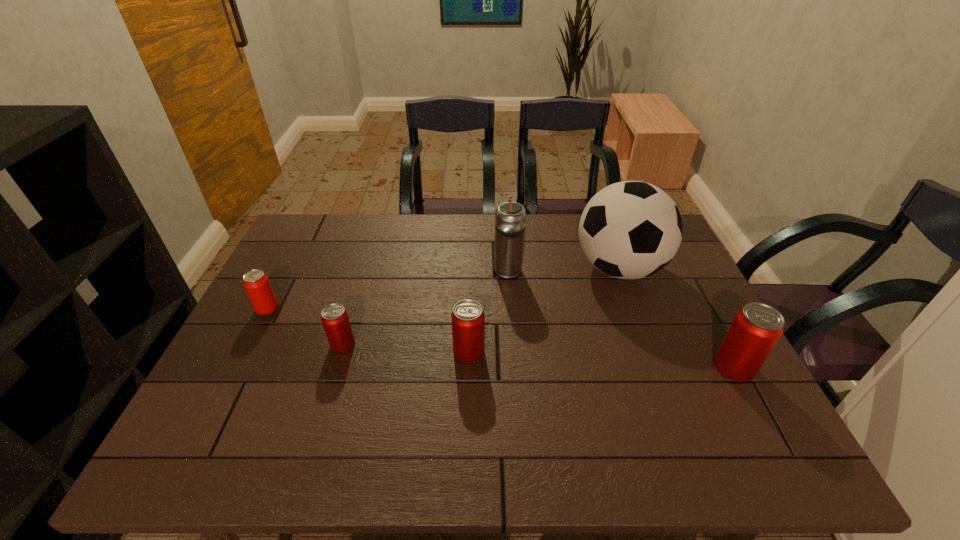
Identify the location of beer can. (257, 285).

Where is `the third farthest object`? The height and width of the screenshot is (540, 960). the third farthest object is located at coordinates (257, 285).

Identify the location of vacant space situated on the front of the shortest can. (326, 399).

I want to click on vacant space situated 0.050m on the left of the fourth tallest object, so click(x=433, y=352).

Find the location of a particular element. vacant area situated on the left of the fourth shortest object is located at coordinates (615, 367).

This screenshot has width=960, height=540. I want to click on free space located on the front of the soccer ball, so click(x=653, y=359).

This screenshot has width=960, height=540. Find the location of `vacant area located 0.080m with a handle on the side of the fourth object from left to right`. vacant area located 0.080m with a handle on the side of the fourth object from left to right is located at coordinates (506, 242).

You are a GUI agent. You are given a task and a screenshot of the screen. Output one action in this format:
    pyautogui.click(x=<x>, y=<y>)
    Task: Click on the vacant space located with a handle on the side of the fourth object from left to right
    
    Given the screenshot: What is the action you would take?
    pyautogui.click(x=505, y=237)

You are a GUI agent. You are given a task and a screenshot of the screen. Output one action in this format:
    pyautogui.click(x=<x>, y=<y>)
    Task: Click on the free space located 0.190m with a handle on the side of the fourth object from left to right
    
    Given the screenshot: What is the action you would take?
    pyautogui.click(x=504, y=224)

Where is `vacant space located on the right of the fourth nearest object`? vacant space located on the right of the fourth nearest object is located at coordinates (315, 309).